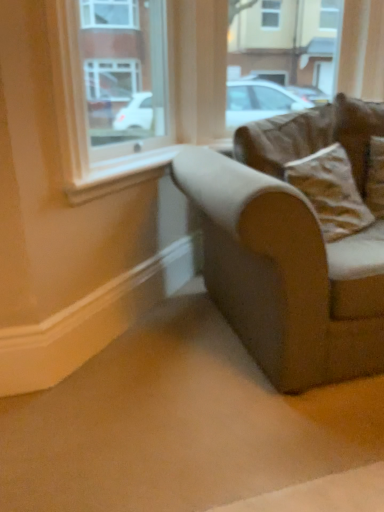
Question: Considering the relative sizes of brown fabric pillow at right, which is the 1th pillow in bottom-to-top order, and brown suede pillow at upper right, marked as the second pillow in a bottom-to-top arrangement, in the image provided, is brown fabric pillow at right, which is the 1th pillow in bottom-to-top order, wider than brown suede pillow at upper right, marked as the second pillow in a bottom-to-top arrangement,?

Choices:
 (A) no
 (B) yes

Answer: (B)

Question: Considering the relative sizes of brown fabric pillow at right, which appears as the second pillow when viewed from the top, and brown suede pillow at upper right, marked as the second pillow in a bottom-to-top arrangement, in the image provided, is brown fabric pillow at right, which appears as the second pillow when viewed from the top, bigger than brown suede pillow at upper right, marked as the second pillow in a bottom-to-top arrangement,?

Choices:
 (A) yes
 (B) no

Answer: (A)

Question: Is brown fabric pillow at right, which appears as the second pillow when viewed from the top, closer to the viewer compared to brown suede pillow at upper right, which is counted as the 1th pillow, starting from the top?

Choices:
 (A) no
 (B) yes

Answer: (B)

Question: Considering the relative positions of brown fabric pillow at right, which is the 1th pillow in bottom-to-top order, and brown suede pillow at upper right, which is counted as the 1th pillow, starting from the top, in the image provided, is brown fabric pillow at right, which is the 1th pillow in bottom-to-top order, to the right of brown suede pillow at upper right, which is counted as the 1th pillow, starting from the top, from the viewer's perspective?

Choices:
 (A) yes
 (B) no

Answer: (B)

Question: Can we say brown fabric pillow at right, which appears as the second pillow when viewed from the top, lies outside brown suede pillow at upper right, which is counted as the 1th pillow, starting from the top?

Choices:
 (A) no
 (B) yes

Answer: (B)

Question: Considering the relative positions of brown fabric pillow at right, which is the 1th pillow in bottom-to-top order, and brown suede pillow at upper right, which is counted as the 1th pillow, starting from the top, in the image provided, is brown fabric pillow at right, which is the 1th pillow in bottom-to-top order, to the left of brown suede pillow at upper right, which is counted as the 1th pillow, starting from the top, from the viewer's perspective?

Choices:
 (A) no
 (B) yes

Answer: (B)

Question: Is clear glass window at upper left not inside brown suede pillow at upper right, marked as the second pillow in a bottom-to-top arrangement?

Choices:
 (A) no
 (B) yes

Answer: (B)

Question: Is clear glass window at upper left positioned in front of brown suede pillow at upper right, marked as the second pillow in a bottom-to-top arrangement?

Choices:
 (A) yes
 (B) no

Answer: (A)

Question: Considering the relative sizes of clear glass window at upper left and brown suede pillow at upper right, marked as the second pillow in a bottom-to-top arrangement, in the image provided, is clear glass window at upper left taller than brown suede pillow at upper right, marked as the second pillow in a bottom-to-top arrangement,?

Choices:
 (A) yes
 (B) no

Answer: (A)

Question: Is the depth of clear glass window at upper left greater than that of brown suede pillow at upper right, marked as the second pillow in a bottom-to-top arrangement?

Choices:
 (A) no
 (B) yes

Answer: (A)

Question: Considering the relative positions of clear glass window at upper left and brown suede pillow at upper right, marked as the second pillow in a bottom-to-top arrangement, in the image provided, is clear glass window at upper left to the right of brown suede pillow at upper right, marked as the second pillow in a bottom-to-top arrangement, from the viewer's perspective?

Choices:
 (A) no
 (B) yes

Answer: (A)

Question: Is brown suede pillow at upper right, marked as the second pillow in a bottom-to-top arrangement, inside clear glass window at upper left?

Choices:
 (A) no
 (B) yes

Answer: (A)

Question: Does brown suede pillow at upper right, which is counted as the 1th pillow, starting from the top, come in front of clear glass window at upper left?

Choices:
 (A) yes
 (B) no

Answer: (B)